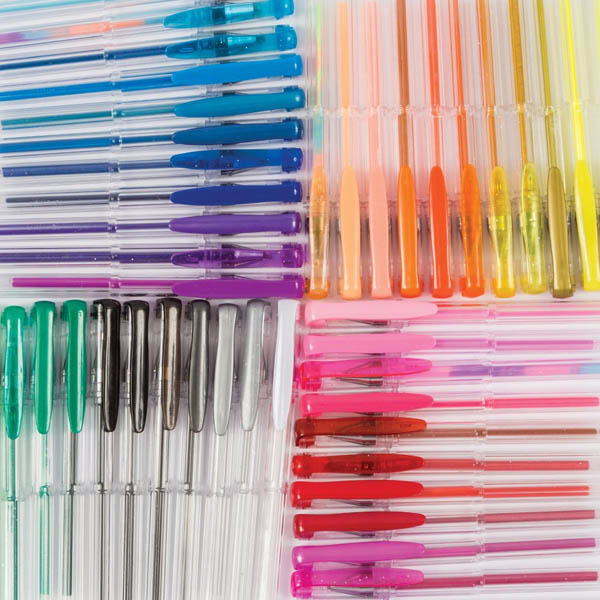
You are a GUI agent. You are given a task and a screenshot of the screen. Output one action in this format:
    pyautogui.click(x=<x>, y=<y>)
    Task: Click on the pens with caps pointing to the left
    This screenshot has width=600, height=600.
    Given the screenshot: What is the action you would take?
    pyautogui.click(x=365, y=312), pyautogui.click(x=362, y=338), pyautogui.click(x=363, y=367), pyautogui.click(x=366, y=395), pyautogui.click(x=366, y=421), pyautogui.click(x=366, y=466), pyautogui.click(x=366, y=493), pyautogui.click(x=370, y=514), pyautogui.click(x=369, y=549), pyautogui.click(x=370, y=571)